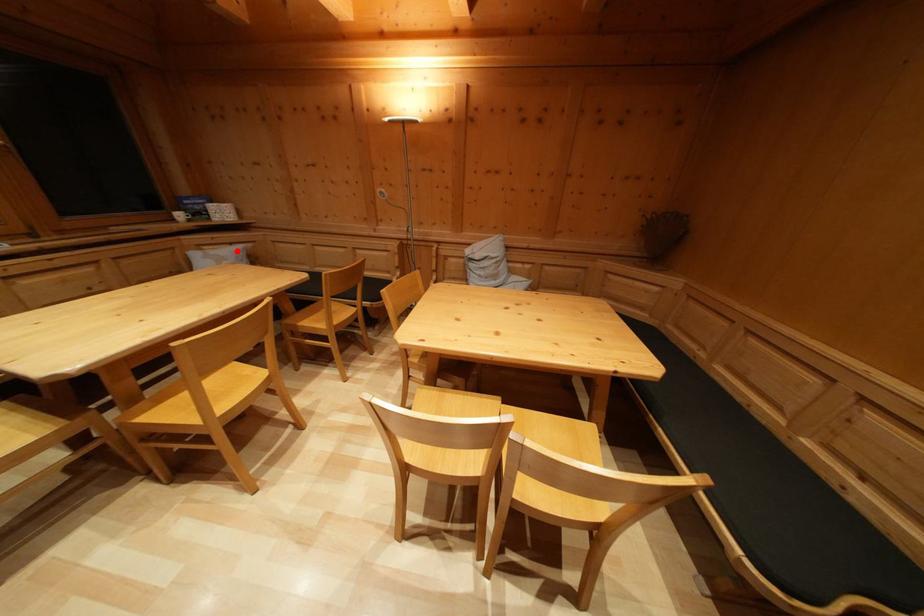
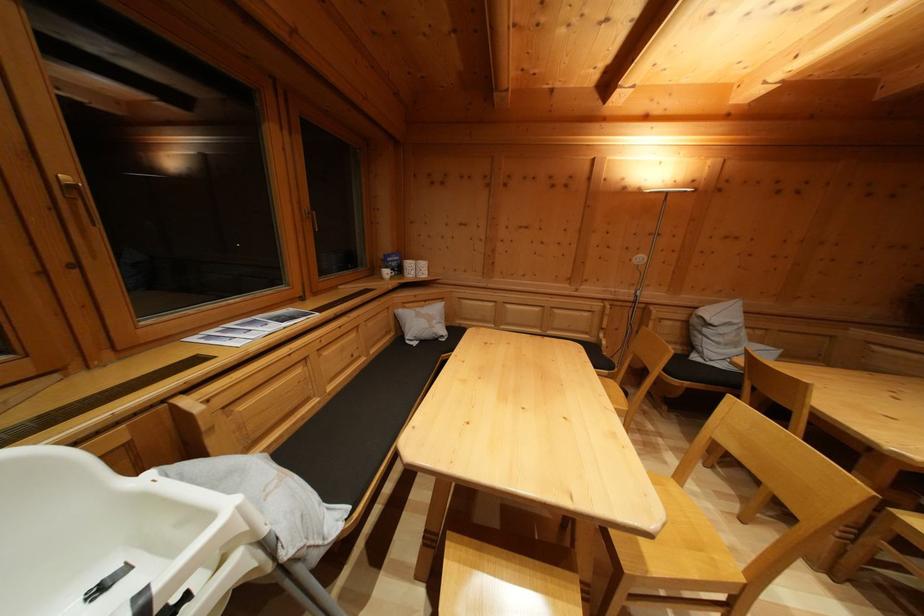
Locate, in the second image, the point that corresponds to the highlighted location in the first image.

(431, 308)